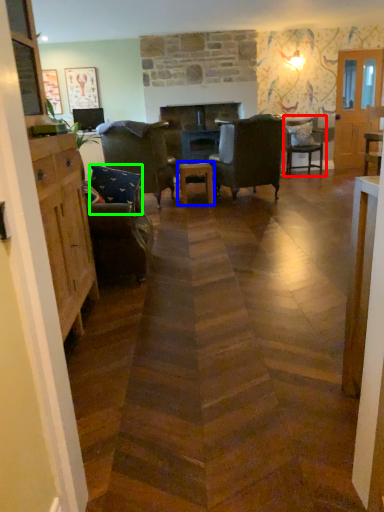
Question: Estimate the real-world distances between objects in this image. Which object is closer to chair (highlighted by a red box), table (highlighted by a blue box) or pillow (highlighted by a green box)?

Choices:
 (A) table
 (B) pillow

Answer: (A)